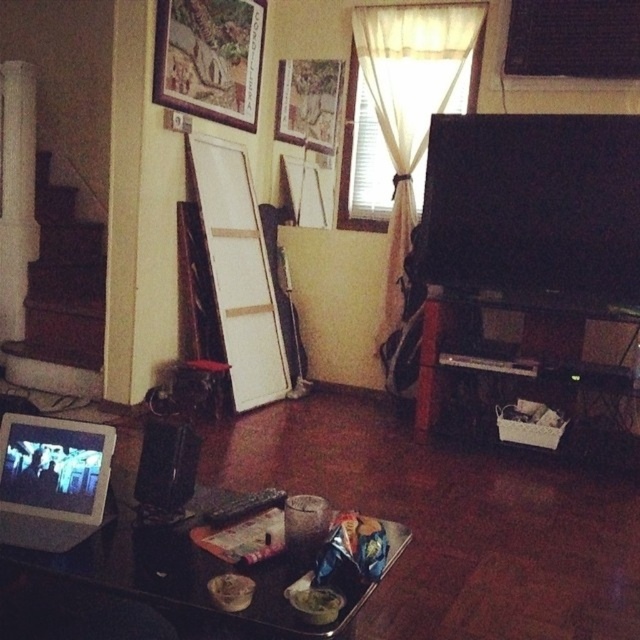
You are trying to determine which object at the upper center of the living room is larger. You see the white sheer curtain at upper center and the wooden picture frame at upper center. Which one is larger?

The white sheer curtain at upper center is bigger than the wooden picture frame at upper center according to the description.

You are trying to hang two picture frames on the wall. The wooden textured picture frame at upper center and the wooden picture frame at upper center. Which one requires more vertical space?

The wooden textured picture frame at upper center requires more vertical space because it is much taller than the wooden picture frame at upper center.

You are organizing a movie night and need to place a large pizza box. The black glossy entertainment center at right and the wooden picture frame at upper center are both potential spots. Based on their sizes, which one can accommodate the pizza box more comfortably?

The black glossy entertainment center at right has a larger size compared to the wooden picture frame at upper center, so it can accommodate the pizza box more comfortably.